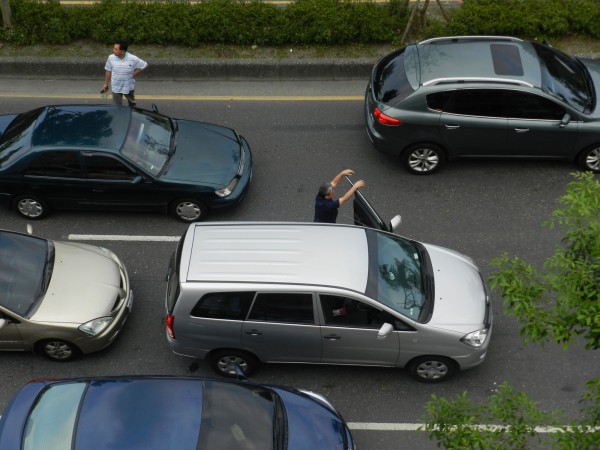
Where is `doors`? doors is located at coordinates (339, 339), (280, 342), (539, 140), (469, 130), (367, 217), (110, 197).